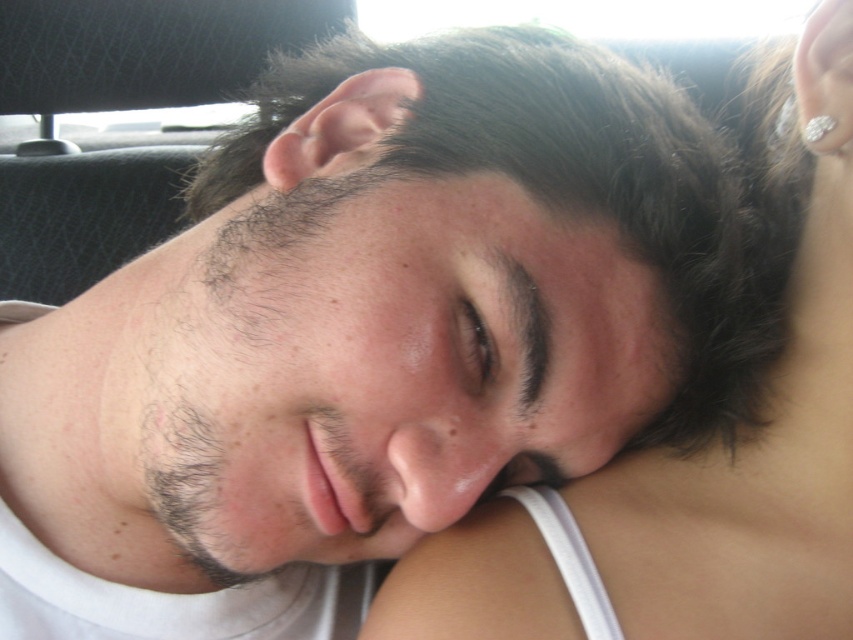
Is white fabric at upper center positioned behind brown matte eye at center?

Yes, it is behind brown matte eye at center.

Consider the image. Who is more distant from viewer, [830,620] or [462,372]?

Positioned behind is point [830,620].

The image size is (853, 640). What are the coordinates of `white fabric at upper center` in the screenshot? It's located at (688, 476).

Does dark brown hair at center lie in front of brown matte eye at center?

Yes, dark brown hair at center is closer to the viewer.

Which is more to the left, dark brown hair at center or brown matte eye at center?

dark brown hair at center is more to the left.

The width and height of the screenshot is (853, 640). What do you see at coordinates (459, 284) in the screenshot?
I see `dark brown hair at center` at bounding box center [459, 284].

Where is `dark brown hair at center`? dark brown hair at center is located at coordinates (459, 284).

In the scene shown: Can you confirm if dark brown hair at center is positioned to the right of white fabric at upper center?

No, dark brown hair at center is not to the right of white fabric at upper center.

Does dark brown hair at center appear on the left side of white fabric at upper center?

Yes, dark brown hair at center is to the left of white fabric at upper center.

Is point (592, 353) in front of point (566, 618)?

No, it is behind (566, 618).

The width and height of the screenshot is (853, 640). Identify the location of dark brown hair at center. (459, 284).